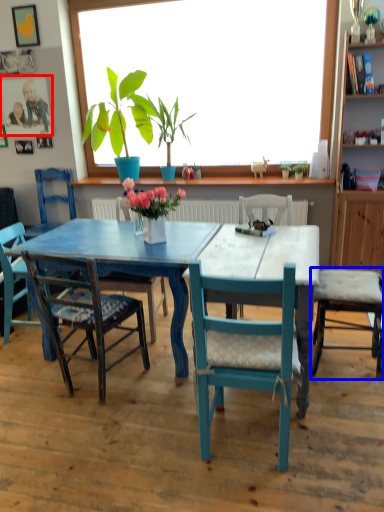
Question: Among these objects, which one is farthest to the camera, picture frame (highlighted by a red box) or chair (highlighted by a blue box)?

Choices:
 (A) picture frame
 (B) chair

Answer: (A)